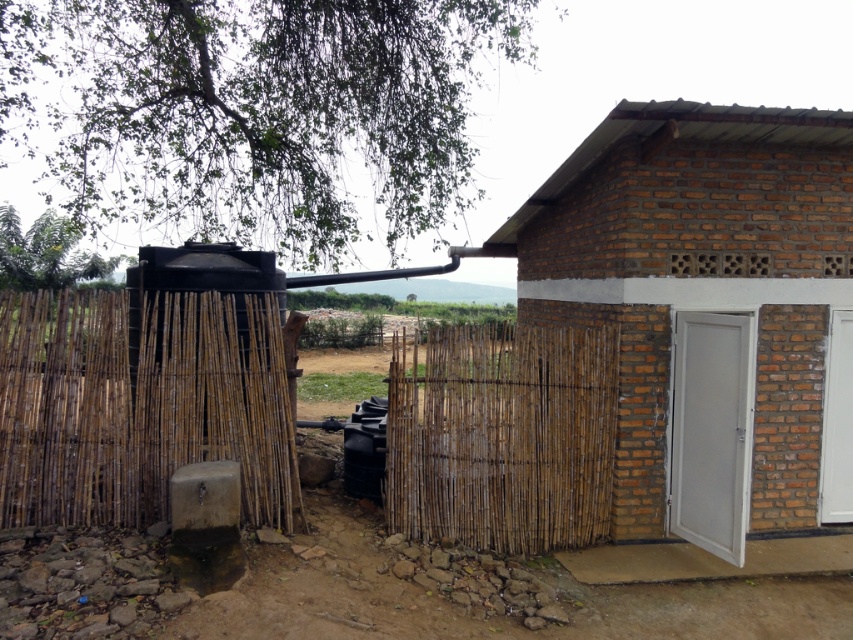
Can you confirm if brown brick door at center is taller than bamboo fence at left?

Correct, brown brick door at center is much taller as bamboo fence at left.

Is point (828, 120) closer to camera compared to point (280, 465)?

That is False.

Does point (848, 317) come farther from viewer compared to point (88, 320)?

Yes, it is behind point (88, 320).

In order to click on brown brick door at center in this screenshot , I will do `click(708, 310)`.

Does brown brick door at center appear on the left side of bamboo fence at center?

No, brown brick door at center is not to the left of bamboo fence at center.

Can you confirm if brown brick door at center is taller than bamboo fence at center?

Yes, brown brick door at center is taller than bamboo fence at center.

Is point (758, 452) behind point (614, 436)?

Yes, it is behind point (614, 436).

Where is `brown brick door at center`? brown brick door at center is located at coordinates (708, 310).

Who is more distant from viewer, (285, 493) or (489, 417)?

The point (489, 417) is more distant.

What do you see at coordinates (138, 404) in the screenshot? Image resolution: width=853 pixels, height=640 pixels. I see `bamboo fence at left` at bounding box center [138, 404].

Image resolution: width=853 pixels, height=640 pixels. I want to click on bamboo fence at left, so click(138, 404).